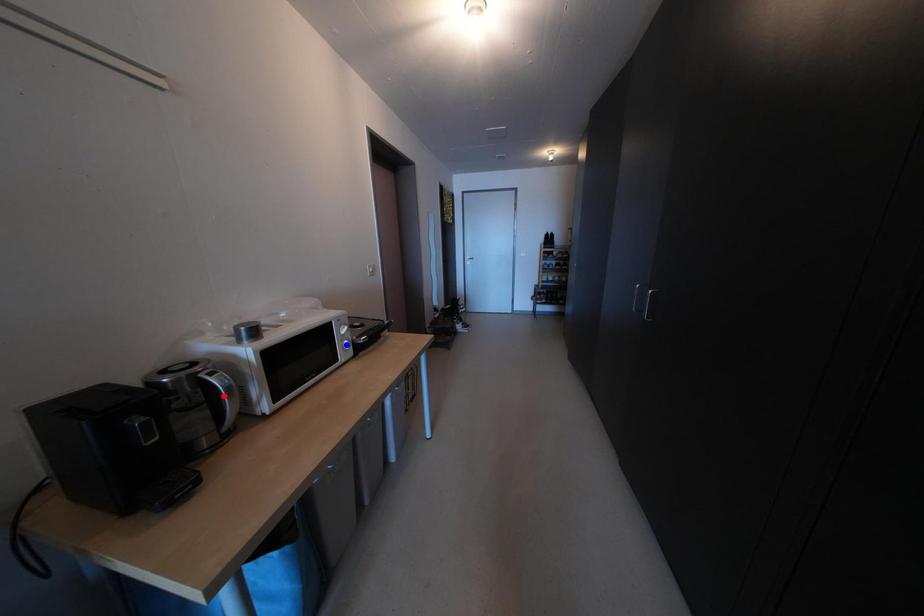
Question: In the image, two points are highlighted. Which point is nearer to the camera? Reply with the corresponding letter.

Choices:
 (A) blue point
 (B) red point

Answer: (B)